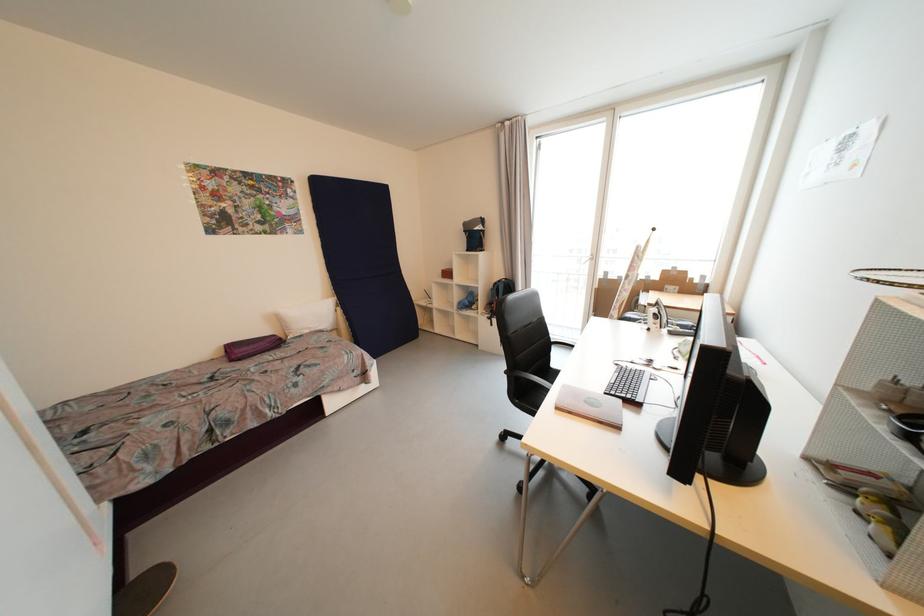
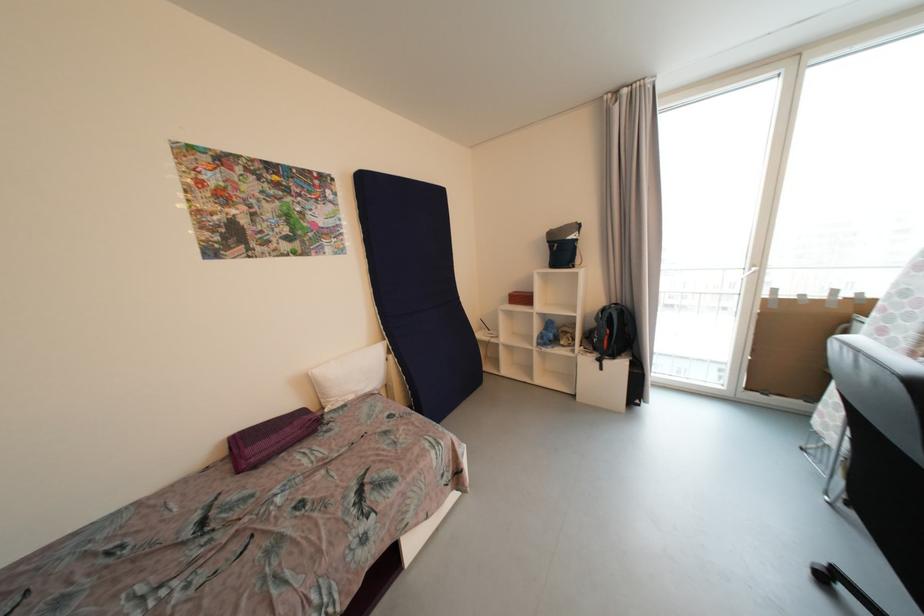
Locate, in the second image, the point that corresponds to point (453, 275) in the first image.

(528, 300)